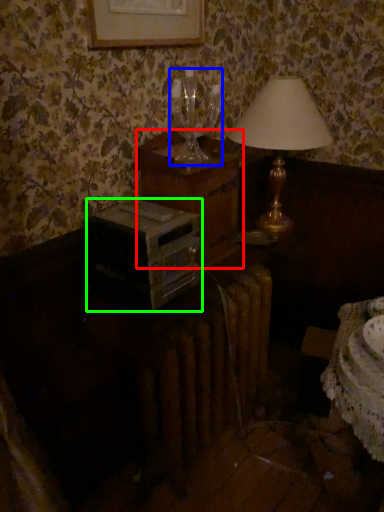
Question: Based on their relative distances, which object is farther from nightstand (highlighted by a red box)? Choose from wine glass (highlighted by a blue box) and stereo (highlighted by a green box).

Choices:
 (A) wine glass
 (B) stereo

Answer: (B)